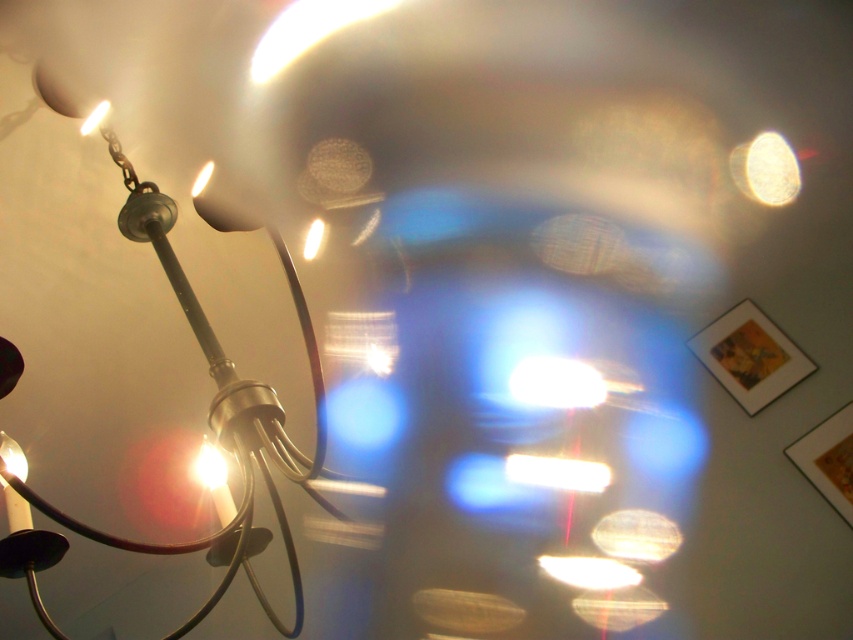
Can you confirm if translucent glass sphere at upper right is thinner than matte white bulb at upper left?

No.

Between translucent glass sphere at upper right and matte white bulb at upper left, which one is positioned lower?

matte white bulb at upper left

From the picture: Who is more forward, (737, 188) or (204, 486)?

Point (737, 188)

Find the location of `translucent glass sphere at upper right`. translucent glass sphere at upper right is located at coordinates (764, 170).

Where is `white glossy light bulb at center`? The width and height of the screenshot is (853, 640). white glossy light bulb at center is located at coordinates (556, 384).

Who is shorter, white glossy light bulb at center or translucent glass sphere at upper right?

Standing shorter between the two is white glossy light bulb at center.

Which is behind, point (589, 376) or point (784, 184)?

Positioned behind is point (589, 376).

You are a GUI agent. You are given a task and a screenshot of the screen. Output one action in this format:
    pyautogui.click(x=<x>, y=<y>)
    Task: Click on the white glossy light bulb at center
    This screenshot has width=853, height=640.
    Given the screenshot: What is the action you would take?
    pyautogui.click(x=556, y=384)

At what (x,y) coordinates should I click in order to perform the action: click on white glossy light bulb at center. Please return your answer as a coordinate pair (x, y). The width and height of the screenshot is (853, 640). Looking at the image, I should click on (556, 384).